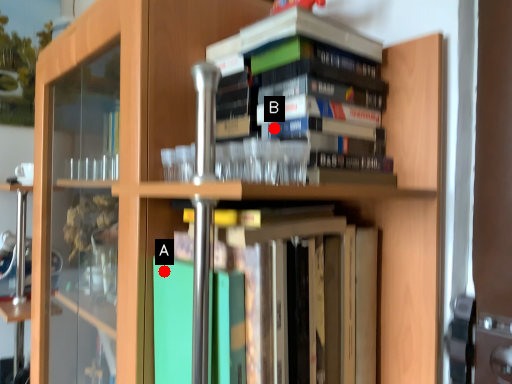
Question: Two points are circled on the image, labeled by A and B beside each circle. Among these points, which one is farthest from the camera?

Choices:
 (A) A is further
 (B) B is further

Answer: (A)